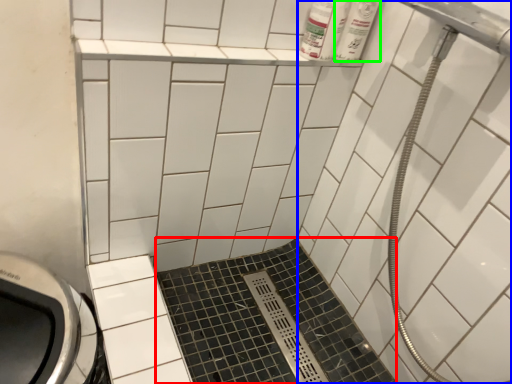
Question: Which object is the closest to the ceramic tile (highlighted by a red box)? Choose among these: bath (highlighted by a blue box) or toiletry (highlighted by a green box).

Choices:
 (A) bath
 (B) toiletry

Answer: (A)